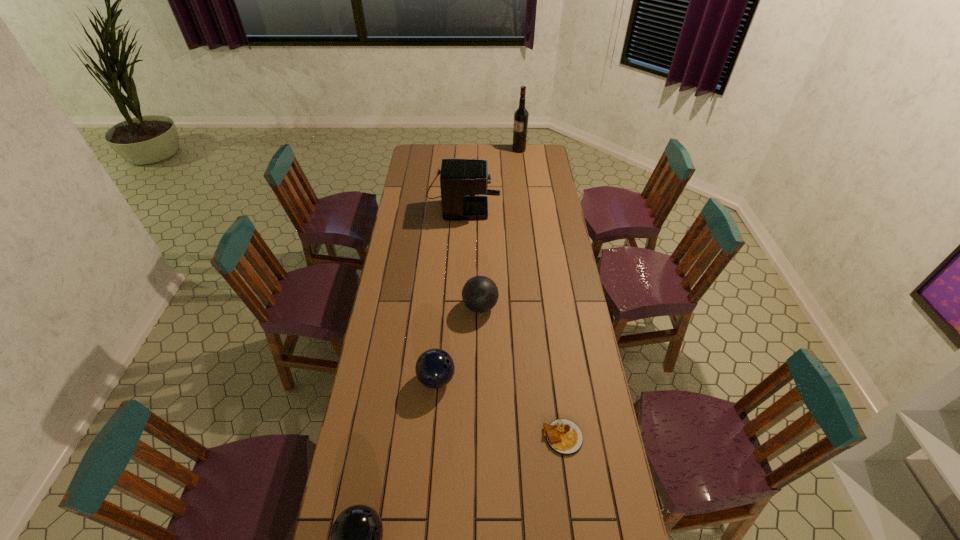
I want to click on the tallest object, so click(x=521, y=115).

What are the coordinates of `the farthest object` in the screenshot? It's located at (521, 115).

Where is `the fifth nearest object`? the fifth nearest object is located at coordinates (460, 179).

This screenshot has height=540, width=960. I want to click on the second tallest object, so (460, 179).

Identify the location of the third farthest object. The width and height of the screenshot is (960, 540). (480, 294).

You are a GUI agent. You are given a task and a screenshot of the screen. Output one action in this format:
    pyautogui.click(x=<x>, y=<y>)
    Task: Click on the farthest bowling ball
    The image size is (960, 540).
    Given the screenshot: What is the action you would take?
    pyautogui.click(x=480, y=294)

Locate an element on the screen. The height and width of the screenshot is (540, 960). the fourth farthest object is located at coordinates (435, 368).

Find the location of `the second nearest bowling ball`. the second nearest bowling ball is located at coordinates (435, 368).

Image resolution: width=960 pixels, height=540 pixels. What are the coordinates of `the fifth farthest object` in the screenshot? It's located at (563, 436).

I want to click on the shortest object, so (x=563, y=436).